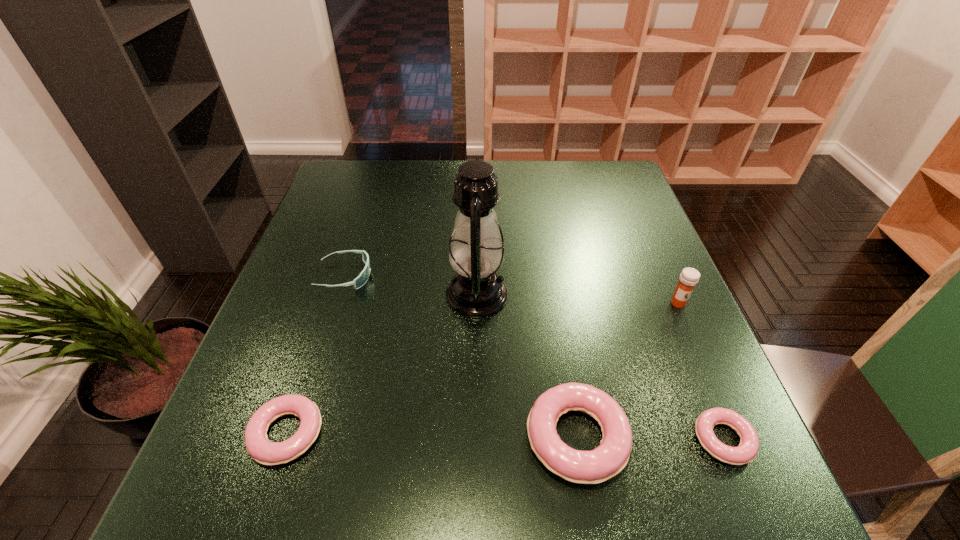
Identify the location of the second shortest doughnut. (259, 447).

Identify the location of the second doughnut from right to left. (608, 459).

The image size is (960, 540). What are the coordinates of `the third tallest object` in the screenshot? It's located at tap(608, 459).

In order to click on the rightmost doughnut in this screenshot , I will do `click(747, 450)`.

At what (x,y) coordinates should I click in order to perform the action: click on the shortest object. Please return your answer as a coordinate pair (x, y). Looking at the image, I should click on (747, 450).

This screenshot has height=540, width=960. I want to click on goggles, so tap(358, 282).

Image resolution: width=960 pixels, height=540 pixels. Find the location of `the fifth shortest object`. the fifth shortest object is located at coordinates (689, 277).

Locate an element on the screen. the fourth object from right to left is located at coordinates (476, 252).

Identify the location of oil lamp. The image size is (960, 540). (476, 252).

This screenshot has width=960, height=540. Find the location of `free location located 0.170m on the right of the leftmost doughnut`. free location located 0.170m on the right of the leftmost doughnut is located at coordinates (420, 434).